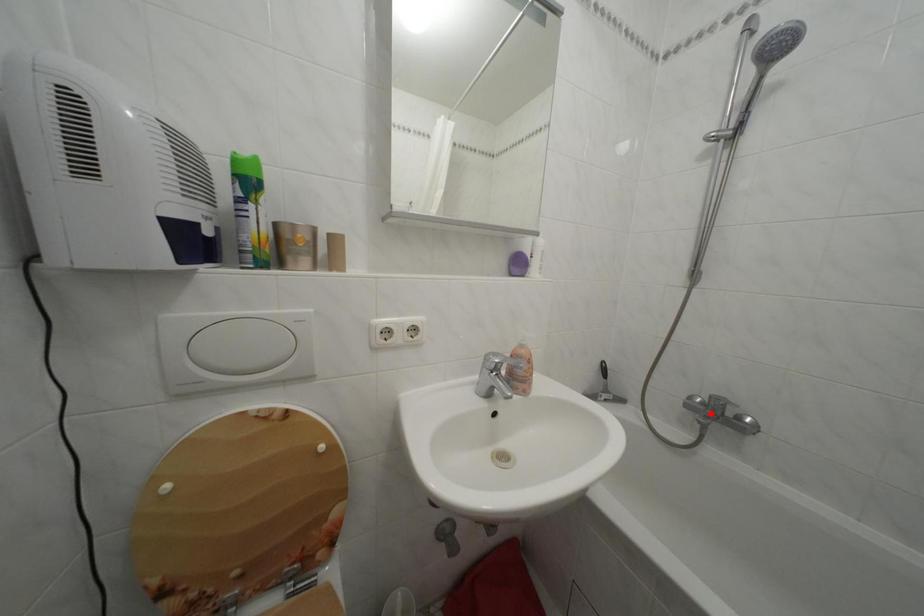
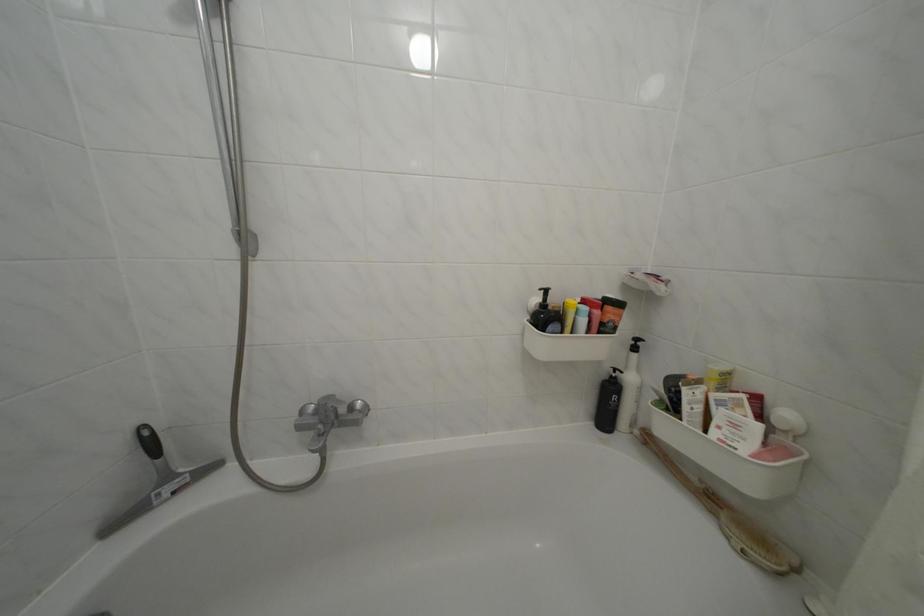
Find the pixel in the second image that matches the highlighted location in the first image.

(323, 426)